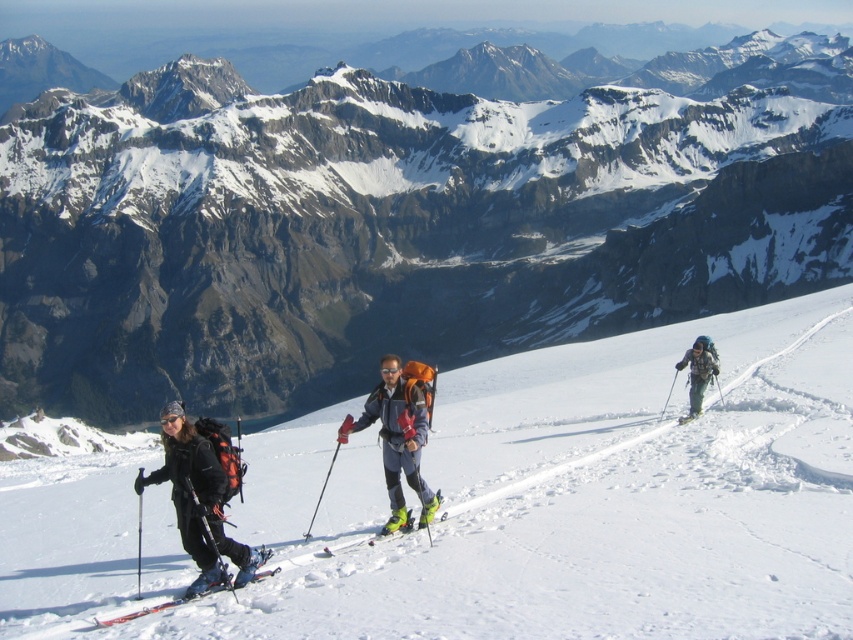
Question: Which point is farther from the camera taking this photo?

Choices:
 (A) (543, 284)
 (B) (688, 413)
 (C) (352, 540)

Answer: (A)

Question: Estimate the real-world distances between objects in this image. Which object is closer to the matte black ski suit at left?

Choices:
 (A) yellow-green plastic ski at center
 (B) orange metallic ski at lower left
 (C) matte gray backpack at right
 (D) matte black ski at right

Answer: (B)

Question: Does matte black ski suit at left have a larger size compared to yellow-green plastic ski at center?

Choices:
 (A) no
 (B) yes

Answer: (B)

Question: Is matte gray rock at center above yellow-green plastic ski at center?

Choices:
 (A) no
 (B) yes

Answer: (B)

Question: Estimate the real-world distances between objects in this image. Which object is closer to the matte black ski at right?

Choices:
 (A) matte gray rock at center
 (B) matte gray backpack at right
 (C) yellow-green plastic ski at center

Answer: (B)

Question: Can you confirm if matte black ski suit at left is positioned above matte black ski at right?

Choices:
 (A) yes
 (B) no

Answer: (B)